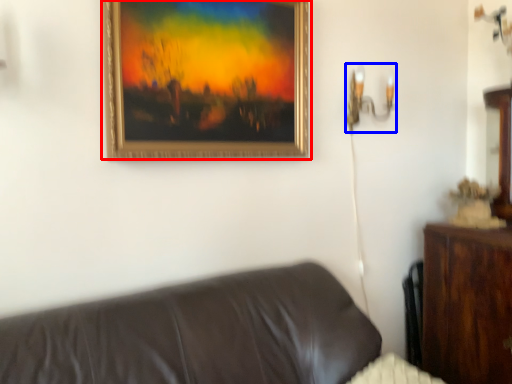
Question: Which object appears farthest to the camera in this image, picture frame (highlighted by a red box) or table lamp (highlighted by a blue box)?

Choices:
 (A) picture frame
 (B) table lamp

Answer: (B)